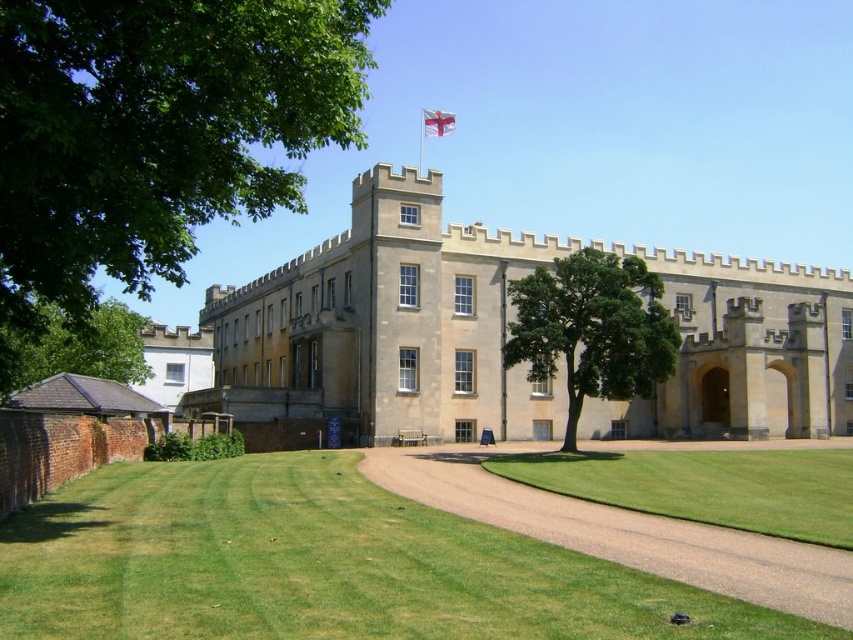
You are standing at the point marked by the coordinates point (393, 321) in front of the beige stone castle at center. What is the name of the structure you are directly in front of?

The point (393, 321) marks the beige stone castle at center, so you are directly in front of the beige stone castle at center.

You are a gardener planning to mow the lawn. The green grass at center and the green leafy tree at lower left are in your path. Which object requires more attention in terms of size when planning your mowing route?

The green leafy tree at lower left requires more attention in terms of size because it is larger than the green grass at center, so you need to ensure the mower avoids it properly.

You are standing in front of the historic building and want to walk towards the two points marked on the lawn. Which point, point (506, 371) or point (451, 116), will you reach first?

You will reach point (506, 371) first because it is closer to you than point (451, 116).